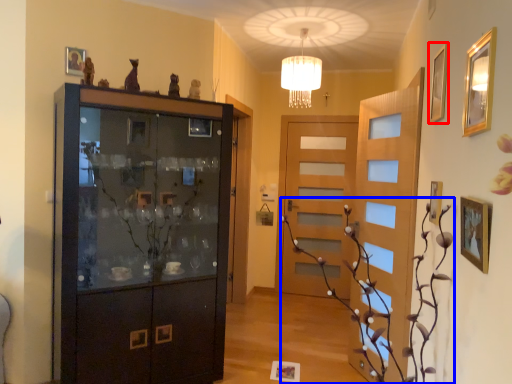
Question: Which object appears closest to the camera in this image, picture frame (highlighted by a red box) or plant (highlighted by a blue box)?

Choices:
 (A) picture frame
 (B) plant

Answer: (B)